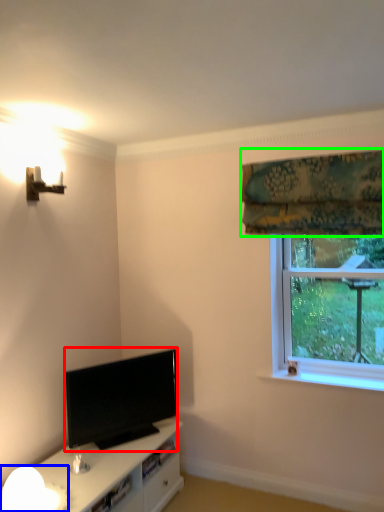
Question: Estimate the real-world distances between objects in this image. Which object is closer to television (highlighted by a red box), lamp (highlighted by a blue box) or curtain (highlighted by a green box)?

Choices:
 (A) lamp
 (B) curtain

Answer: (A)